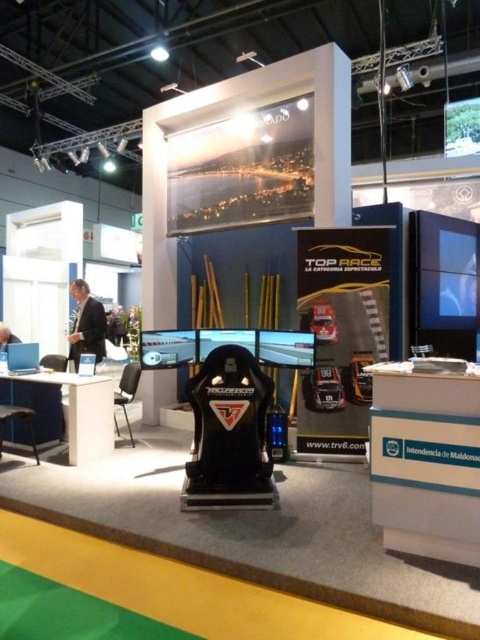
In the scene shown: Is black suit at left above matte black chair at lower left?

Yes.

Can you confirm if black suit at left is positioned to the left of matte black chair at lower left?

Incorrect, black suit at left is not on the left side of matte black chair at lower left.

This screenshot has width=480, height=640. I want to click on black suit at left, so coord(86,324).

Where is `black suit at left`? black suit at left is located at coordinates (86, 324).